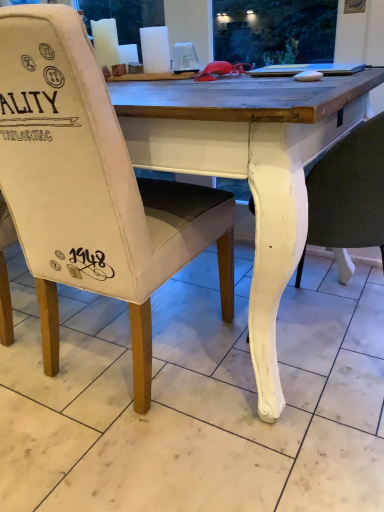
This screenshot has height=512, width=384. Identify the location of free space above white marble tile at lower center (from a real-world perspective). (181, 350).